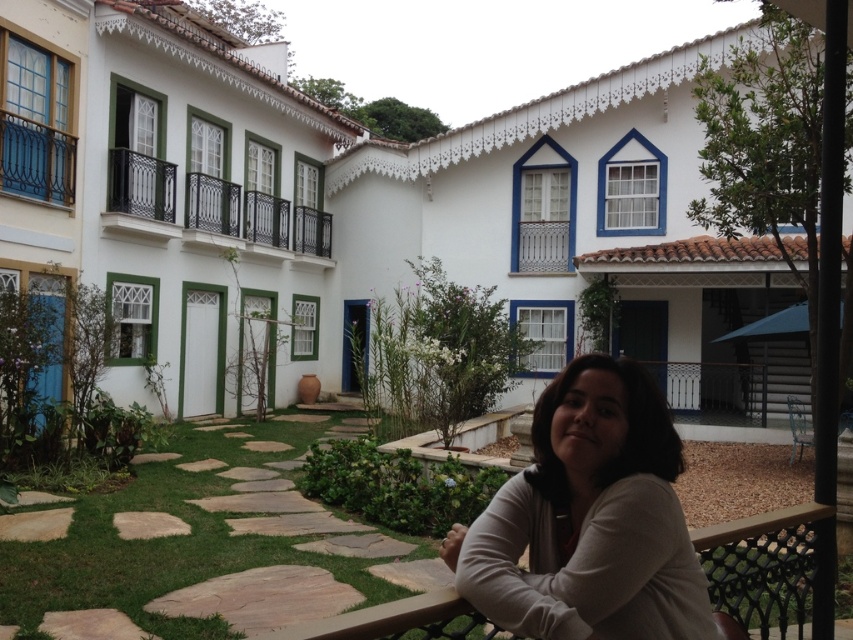
Does white matte shirt at lower right have a smaller size compared to matte blue balcony at upper left?

Indeed, white matte shirt at lower right has a smaller size compared to matte blue balcony at upper left.

Does white matte shirt at lower right appear under matte blue balcony at upper left?

Correct, white matte shirt at lower right is located below matte blue balcony at upper left.

You are a GUI agent. You are given a task and a screenshot of the screen. Output one action in this format:
    pyautogui.click(x=<x>, y=<y>)
    Task: Click on the white matte shirt at lower right
    The height and width of the screenshot is (640, 853).
    Given the screenshot: What is the action you would take?
    pyautogui.click(x=589, y=518)

Is point (474, 538) positioned before point (733, 532)?

Yes, point (474, 538) is closer to viewer.

Between white matte shirt at lower right and brown wooden balustrade at lower right, which one appears on the left side from the viewer's perspective?

Positioned to the left is white matte shirt at lower right.

Is point (567, 550) positioned in front of point (397, 621)?

No, (567, 550) is further to viewer.

At what (x,y) coordinates should I click in order to perform the action: click on white matte shirt at lower right. Please return your answer as a coordinate pair (x, y). The image size is (853, 640). Looking at the image, I should click on (589, 518).

Who is more distant from viewer, (631,426) or (252,212)?

The point (252,212) is more distant.

Who is positioned more to the right, white matte shirt at lower right or black wrought iron balcony at upper left?

white matte shirt at lower right

Where is `white matte shirt at lower right`? Image resolution: width=853 pixels, height=640 pixels. white matte shirt at lower right is located at coordinates (589, 518).